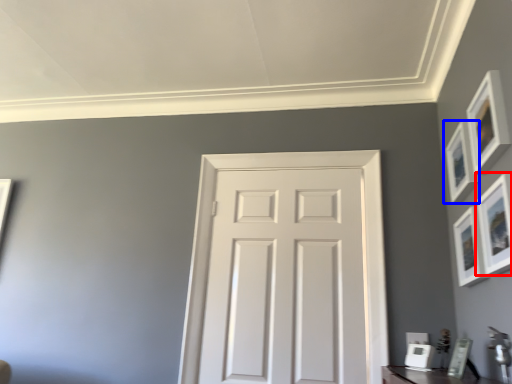
Question: Which point is further to the camera, picture frame (highlighted by a red box) or picture frame (highlighted by a blue box)?

Choices:
 (A) picture frame
 (B) picture frame

Answer: (B)